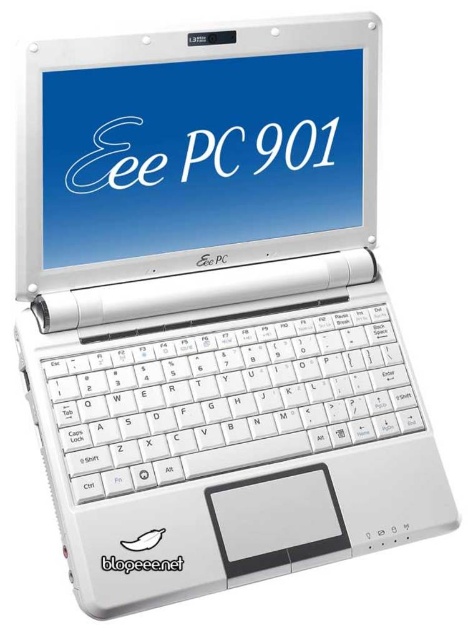
You are designing a protective case for the Eee PC 901 laptop. The case must accommodate both the matte white screen at center and the white plastic keyboard at center. What is the minimum vertical space required between these two components to ensure proper fit?

The minimum vertical space required between the matte white screen at center and the white plastic keyboard at center is 10.10 inches to ensure the case accommodates both components properly.

You are looking at the Eee PC 901 laptop. Where is the matte white screen at center in relation to the white plastic keyboard at center?

The matte white screen at center is located above the white plastic keyboard at center.